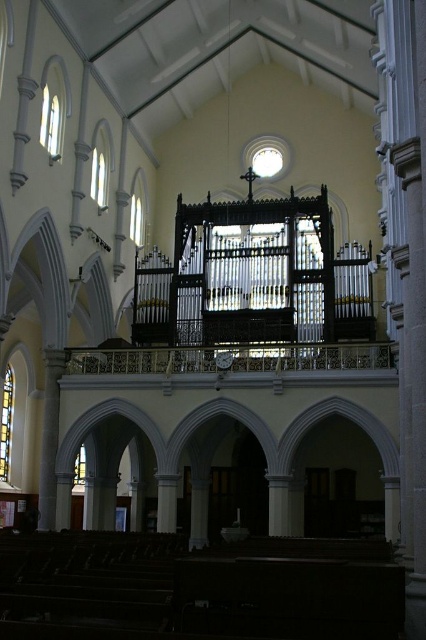
You are an interior designer planning to place a new sculpture in the church. The sculpture requires a space wider than the polished brass pipe organ at center. Can the clear glass window at upper left accommodate this requirement?

The polished brass pipe organ at center might be wider than the clear glass window at upper left, so it is uncertain if the clear glass window at upper left can accommodate the sculpture requiring a space wider than the organ.